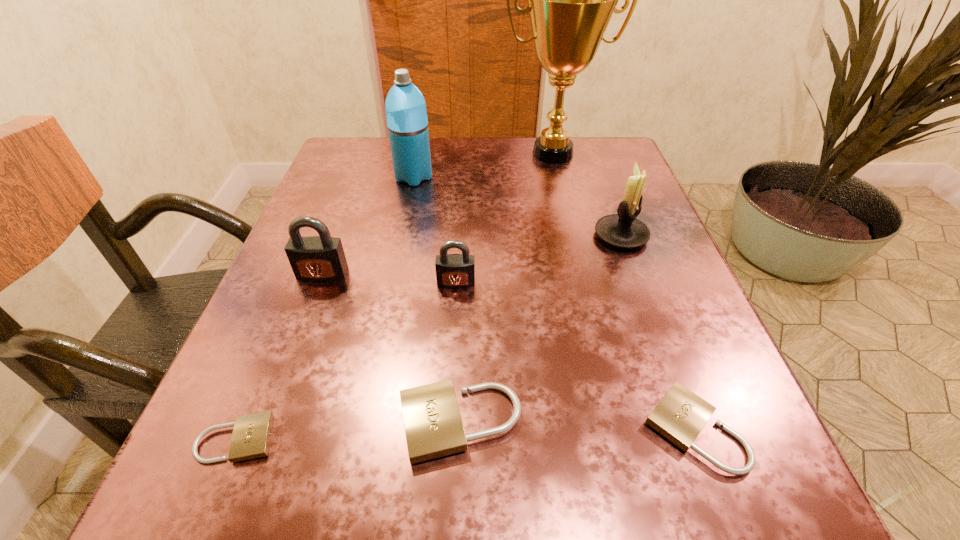
Locate an element on the screen. vacant space at the far right corner of the desktop is located at coordinates (574, 185).

Where is `free point at the near right corner`? The image size is (960, 540). free point at the near right corner is located at coordinates (653, 478).

Image resolution: width=960 pixels, height=540 pixels. Find the location of `free spot between the bigger gray padlock and the third tallest padlock`. free spot between the bigger gray padlock and the third tallest padlock is located at coordinates click(391, 348).

Where is `vacant region between the candle holder and the left gray padlock`? This screenshot has width=960, height=540. vacant region between the candle holder and the left gray padlock is located at coordinates (471, 255).

Image resolution: width=960 pixels, height=540 pixels. I want to click on vacant area that lies between the second shortest padlock and the third farthest object, so click(x=658, y=333).

The width and height of the screenshot is (960, 540). In order to click on vacant space that's between the second biggest beige padlock and the tallest padlock in this screenshot , I will do `click(508, 352)`.

Where is `free point between the leftmost beige padlock and the award`? The width and height of the screenshot is (960, 540). free point between the leftmost beige padlock and the award is located at coordinates (395, 296).

Where is `free space between the second shortest object and the thermos bottle`? The image size is (960, 540). free space between the second shortest object and the thermos bottle is located at coordinates (554, 303).

Locate an element on the screen. empty space between the rightmost padlock and the sixth tallest object is located at coordinates (576, 426).

Identify the location of free space between the fifth tallest object and the shortest padlock. This screenshot has width=960, height=540. (347, 361).